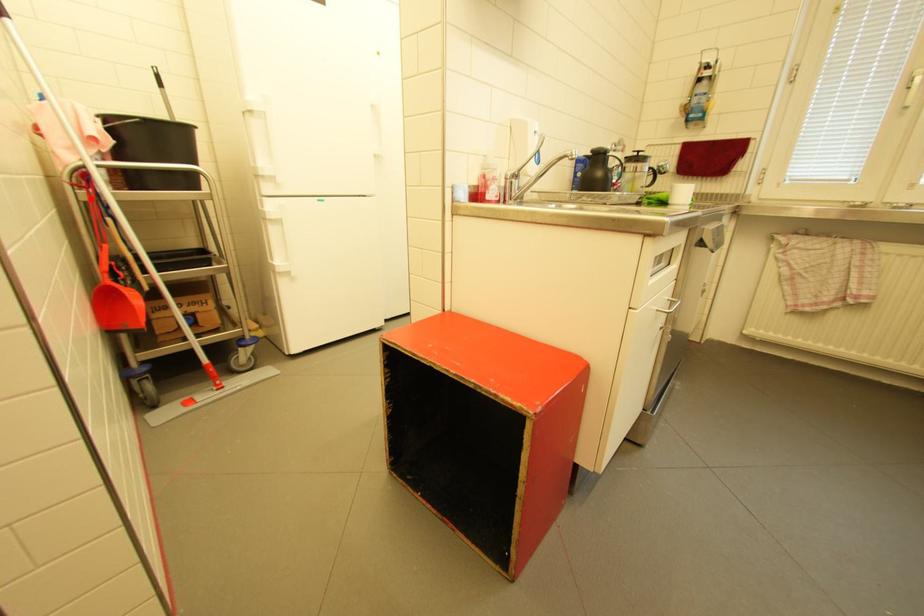
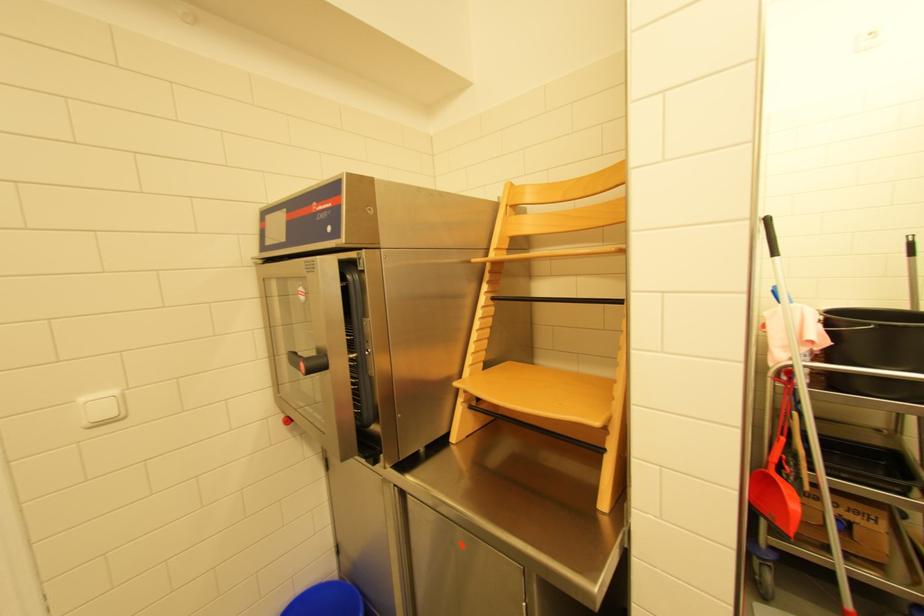
Find the pixel in the second image that matches the highlighted location in the first image.

(787, 391)